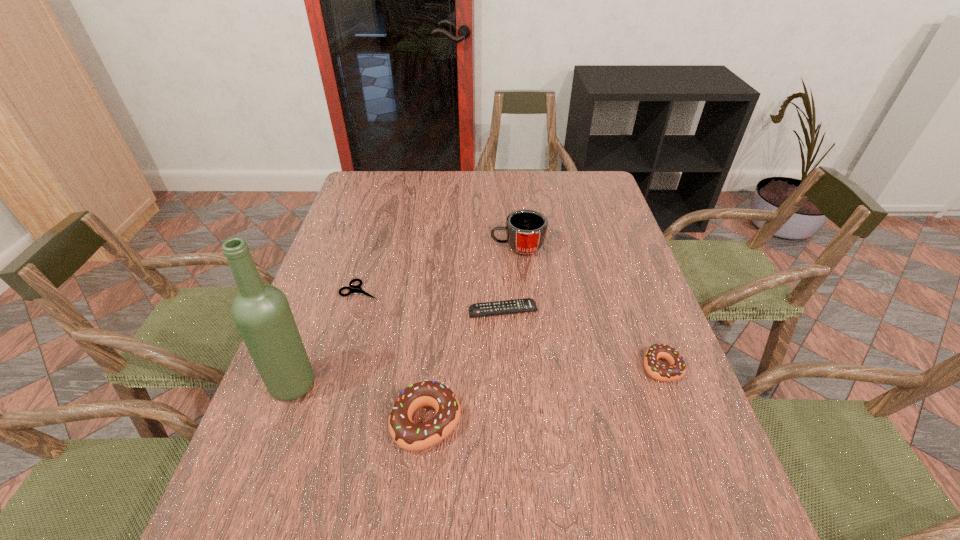
Identify the location of the taller doughnut. (408, 435).

Find the location of `the nearer doughnut`. the nearer doughnut is located at coordinates (408, 435).

The width and height of the screenshot is (960, 540). Identify the location of the fourth tallest object. (677, 368).

Locate an element on the screen. This screenshot has width=960, height=540. the shorter doughnut is located at coordinates (677, 368).

The width and height of the screenshot is (960, 540). What are the coordinates of `mug` in the screenshot? It's located at (526, 229).

At what (x,y) coordinates should I click in order to perform the action: click on the farthest object. Please return your answer as a coordinate pair (x, y). Looking at the image, I should click on (526, 229).

Identify the location of the second farthest object. (353, 289).

Locate an element on the screen. The image size is (960, 540). the shortest object is located at coordinates (353, 289).

This screenshot has width=960, height=540. Find the location of `the tallest object`. the tallest object is located at coordinates (261, 312).

Where is `remote control`? remote control is located at coordinates (528, 304).